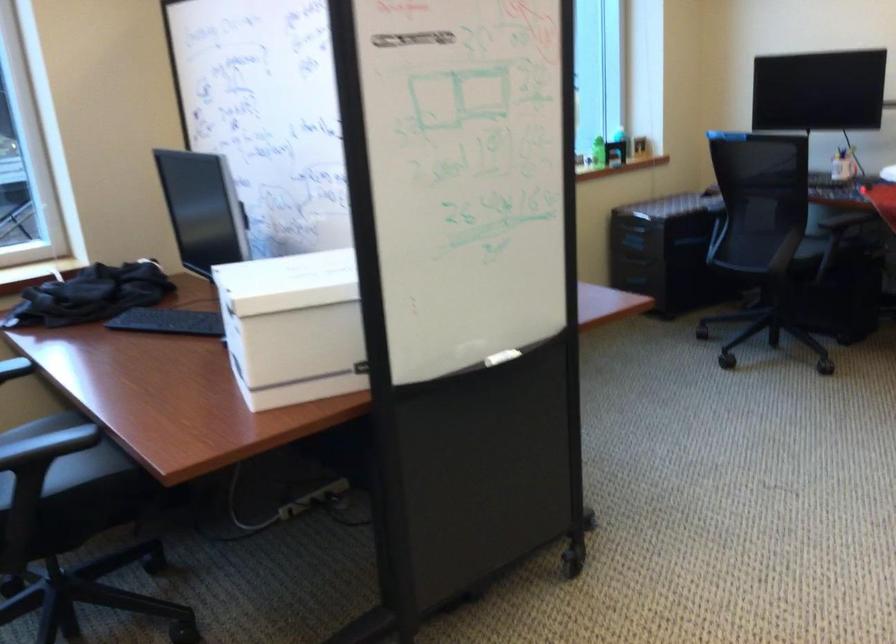
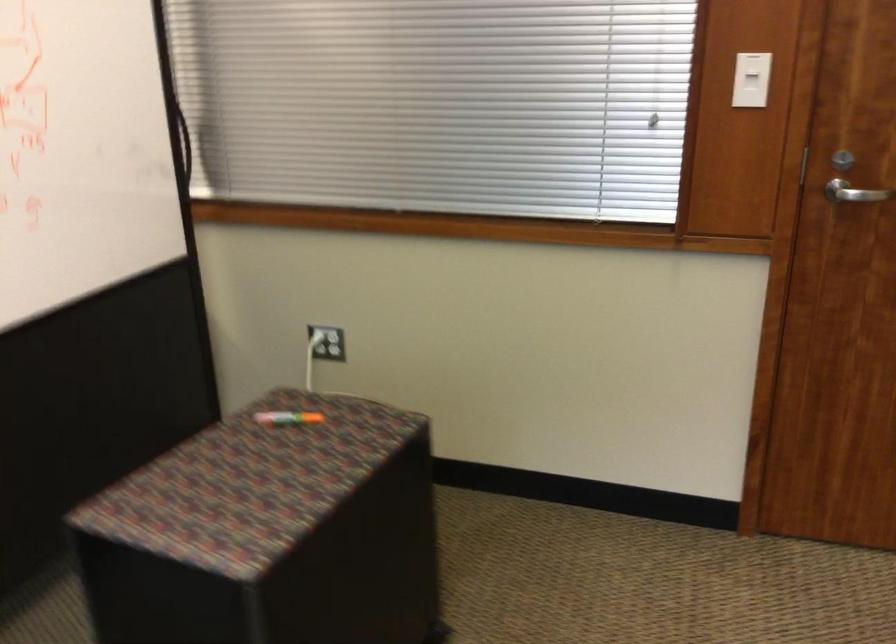
Based on the continuous images, in which direction is the camera rotating?

The camera rotated toward right-down.